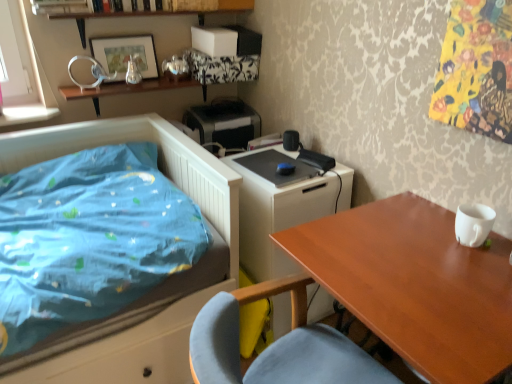
Question: Would you say black plastic printer at upper center is part of metallic silver picture frame at upper left's contents?

Choices:
 (A) yes
 (B) no

Answer: (B)

Question: Does metallic silver picture frame at upper left come behind black plastic printer at upper center?

Choices:
 (A) no
 (B) yes

Answer: (A)

Question: Does metallic silver picture frame at upper left appear on the left side of black plastic printer at upper center?

Choices:
 (A) no
 (B) yes

Answer: (B)

Question: Considering the relative sizes of metallic silver picture frame at upper left and black plastic printer at upper center in the image provided, is metallic silver picture frame at upper left wider than black plastic printer at upper center?

Choices:
 (A) no
 (B) yes

Answer: (A)

Question: Does metallic silver picture frame at upper left turn towards black plastic printer at upper center?

Choices:
 (A) no
 (B) yes

Answer: (A)

Question: From the image's perspective, would you say metallic silver picture frame at upper left is shown under black plastic printer at upper center?

Choices:
 (A) yes
 (B) no

Answer: (B)

Question: From a real-world perspective, is metallic silver picture frame at upper left physically below wooden table at right?

Choices:
 (A) no
 (B) yes

Answer: (A)

Question: Is wooden table at right located within metallic silver picture frame at upper left?

Choices:
 (A) no
 (B) yes

Answer: (A)

Question: Is metallic silver picture frame at upper left shorter than wooden table at right?

Choices:
 (A) no
 (B) yes

Answer: (B)

Question: From a real-world perspective, does metallic silver picture frame at upper left stand above wooden table at right?

Choices:
 (A) yes
 (B) no

Answer: (A)

Question: Does metallic silver picture frame at upper left lie behind wooden table at right?

Choices:
 (A) yes
 (B) no

Answer: (A)

Question: Can you confirm if metallic silver picture frame at upper left is taller than wooden table at right?

Choices:
 (A) no
 (B) yes

Answer: (A)

Question: Can you confirm if blue fabric bed at left is shorter than metallic silver picture frame at upper left?

Choices:
 (A) yes
 (B) no

Answer: (B)